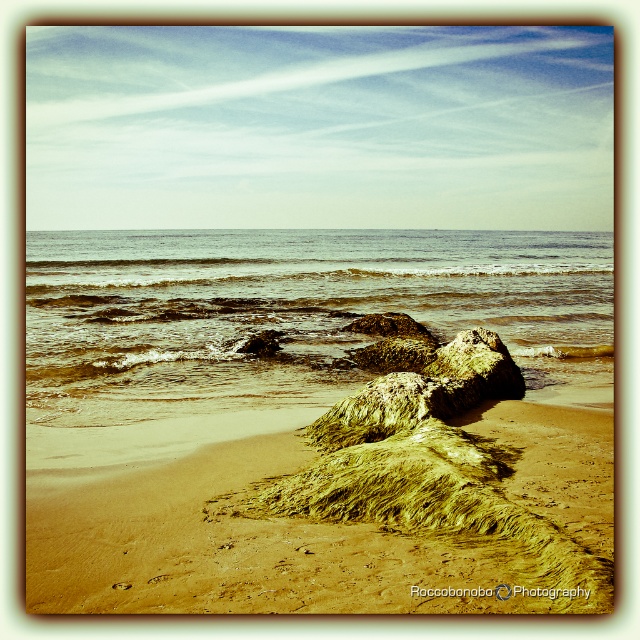
You are standing on the beach and want to take a photo of the golden sandy beach at center. Where should you point your camera to capture it?

You should point your camera towards the center of the scene at coordinates approximately 0.820 on the x axis and 0.537 on the y axis to capture the golden sandy beach at center.

You are standing on the golden sandy beach at center and want to walk to the clear water at center. Which direction should you move in?

Since the golden sandy beach at center is positioned under the clear water at center, you should move upward to reach the clear water at center from the golden sandy beach at center.

You are standing on the golden sandy beach at center and want to reach the clear water at center. Based on the scene description, which direction should you move to get to the water?

Since the golden sandy beach at center is thinner than the clear water at center, you should move forward towards the direction where the beach narrows into the water.